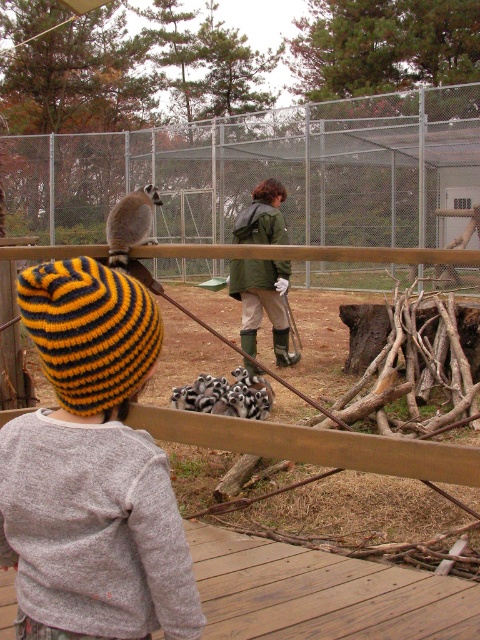
You are a visitor at the zoo and want to take a photo of the black and white striped lemur at center without the metal fence at upper center appearing in the shot. Is this possible?

The black and white striped lemur at center is behind the metal fence at upper center, so you cannot take a photo of the lemur without the fence appearing in the shot.